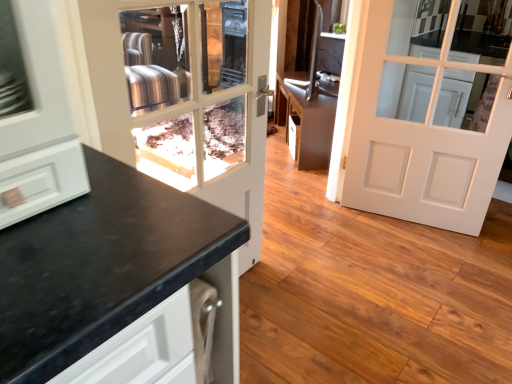
Identify the location of white matte door at center, placed as the second door when sorted from left to right. (429, 112).

Locate an element on the screen. matte black door at center, arranged as the first door when viewed from the left is located at coordinates pyautogui.click(x=183, y=95).

Does white matte door at center, placed as the first door when sorted from right to left, have a greater width compared to matte black door at center, marked as the second door in a right-to-left arrangement?

Indeed, white matte door at center, placed as the first door when sorted from right to left, has a greater width compared to matte black door at center, marked as the second door in a right-to-left arrangement.

Is the position of white matte door at center, placed as the first door when sorted from right to left, less distant than that of matte black door at center, marked as the second door in a right-to-left arrangement?

No, the depth of white matte door at center, placed as the first door when sorted from right to left, is greater than that of matte black door at center, marked as the second door in a right-to-left arrangement.

Is white matte door at center, placed as the first door when sorted from right to left, looking in the opposite direction of matte black door at center, marked as the second door in a right-to-left arrangement?

No, white matte door at center, placed as the first door when sorted from right to left, is not facing away from matte black door at center, marked as the second door in a right-to-left arrangement.

Does point (388, 142) lie behind point (240, 136)?

No, (388, 142) is in front of (240, 136).

Considering the relative positions of matte black door at center, marked as the second door in a right-to-left arrangement, and white matte door at center, placed as the second door when sorted from left to right, in the image provided, is matte black door at center, marked as the second door in a right-to-left arrangement, to the left of white matte door at center, placed as the second door when sorted from left to right, from the viewer's perspective?

Yes, matte black door at center, marked as the second door in a right-to-left arrangement, is to the left of white matte door at center, placed as the second door when sorted from left to right.

Is matte black door at center, arranged as the first door when viewed from the left, touching white matte door at center, placed as the first door when sorted from right to left?

No, matte black door at center, arranged as the first door when viewed from the left, is not beside white matte door at center, placed as the first door when sorted from right to left.

This screenshot has height=384, width=512. Identify the location of door that appears on the right of matte black door at center, arranged as the first door when viewed from the left. (429, 112).

Consider the image. Can you tell me how much matte black door at center, arranged as the first door when viewed from the left, and white matte door at center, placed as the second door when sorted from left to right, differ in facing direction?

The facing directions of matte black door at center, arranged as the first door when viewed from the left, and white matte door at center, placed as the second door when sorted from left to right, are 75.2 degrees apart.

From the picture: Does brown matte cabinet at center turn towards matte black door at center, marked as the second door in a right-to-left arrangement?

No, brown matte cabinet at center is not aimed at matte black door at center, marked as the second door in a right-to-left arrangement.

Is point (313, 164) positioned after point (122, 91)?

That is True.

Is brown matte cabinet at center not inside matte black door at center, arranged as the first door when viewed from the left?

Yes, brown matte cabinet at center is outside of matte black door at center, arranged as the first door when viewed from the left.

Are brown matte cabinet at center and matte black door at center, arranged as the first door when viewed from the left, making contact?

No, brown matte cabinet at center is not making contact with matte black door at center, arranged as the first door when viewed from the left.

Looking at the image, does matte black door at center, marked as the second door in a right-to-left arrangement, seem bigger or smaller compared to brown matte cabinet at center?

Considering their sizes, matte black door at center, marked as the second door in a right-to-left arrangement, takes up less space than brown matte cabinet at center.

Is matte black door at center, arranged as the first door when viewed from the left, to the left of brown matte cabinet at center from the viewer's perspective?

Correct, you'll find matte black door at center, arranged as the first door when viewed from the left, to the left of brown matte cabinet at center.

Is matte black door at center, arranged as the first door when viewed from the left, facing away from brown matte cabinet at center?

That's not correct — matte black door at center, arranged as the first door when viewed from the left, is not looking away from brown matte cabinet at center.

How many degrees apart are the facing directions of matte black door at center, marked as the second door in a right-to-left arrangement, and brown matte cabinet at center?

matte black door at center, marked as the second door in a right-to-left arrangement, and brown matte cabinet at center are facing 125 degrees away from each other.

Considering the relative sizes of white matte door at center, placed as the first door when sorted from right to left, and brown matte cabinet at center in the image provided, is white matte door at center, placed as the first door when sorted from right to left, wider than brown matte cabinet at center?

Incorrect, the width of white matte door at center, placed as the first door when sorted from right to left, does not surpass that of brown matte cabinet at center.

What's the angular difference between white matte door at center, placed as the first door when sorted from right to left, and brown matte cabinet at center's facing directions?

The facing directions of white matte door at center, placed as the first door when sorted from right to left, and brown matte cabinet at center are 50.1 degrees apart.

Between point (371, 39) and point (323, 131), which one is positioned in front?

The point (371, 39) is closer to the camera.

Is white matte door at center, placed as the first door when sorted from right to left, not within brown matte cabinet at center?

Yes.

Is white matte door at center, placed as the first door when sorted from right to left, at the back of brown matte cabinet at center?

brown matte cabinet at center does not have its back to white matte door at center, placed as the first door when sorted from right to left.

From a real-world perspective, between brown matte cabinet at center and white matte door at center, placed as the first door when sorted from right to left, who is vertically higher?

In real-world perspective, white matte door at center, placed as the first door when sorted from right to left, is above.

Is brown matte cabinet at center positioned beyond the bounds of white matte door at center, placed as the second door when sorted from left to right?

Yes, brown matte cabinet at center is outside of white matte door at center, placed as the second door when sorted from left to right.

Is brown matte cabinet at center next to white matte door at center, placed as the first door when sorted from right to left, and touching it?

There is a gap between brown matte cabinet at center and white matte door at center, placed as the first door when sorted from right to left.

Find the location of a particular element. This screenshot has height=384, width=512. door beneath the matte black door at center, marked as the second door in a right-to-left arrangement (from a real-world perspective) is located at coordinates (429, 112).

This screenshot has height=384, width=512. I want to click on door on the right side of matte black door at center, marked as the second door in a right-to-left arrangement, so click(x=429, y=112).

Estimate the real-world distances between objects in this image. Which object is further from matte black door at center, marked as the second door in a right-to-left arrangement, white matte door at center, placed as the first door when sorted from right to left, or brown matte cabinet at center?

white matte door at center, placed as the first door when sorted from right to left.

From the image, which object appears to be farther from white matte door at center, placed as the first door when sorted from right to left, brown matte cabinet at center or matte black door at center, marked as the second door in a right-to-left arrangement?

matte black door at center, marked as the second door in a right-to-left arrangement, is positioned further to the anchor white matte door at center, placed as the first door when sorted from right to left.

Estimate the real-world distances between objects in this image. Which object is further from matte black door at center, arranged as the first door when viewed from the left, brown matte cabinet at center or white matte door at center, placed as the first door when sorted from right to left?

Based on the image, white matte door at center, placed as the first door when sorted from right to left, appears to be further to matte black door at center, arranged as the first door when viewed from the left.

Looking at the image, which one is located closer to white matte door at center, placed as the second door when sorted from left to right, matte black door at center, arranged as the first door when viewed from the left, or brown matte cabinet at center?

brown matte cabinet at center is closer to white matte door at center, placed as the second door when sorted from left to right.

Which object lies nearer to the anchor point brown matte cabinet at center, white matte door at center, placed as the second door when sorted from left to right, or matte black door at center, arranged as the first door when viewed from the left?

Among the two, white matte door at center, placed as the second door when sorted from left to right, is located nearer to brown matte cabinet at center.

Looking at the image, which one is located further to brown matte cabinet at center, matte black door at center, arranged as the first door when viewed from the left, or white matte door at center, placed as the first door when sorted from right to left?

matte black door at center, arranged as the first door when viewed from the left, is further to brown matte cabinet at center.

The image size is (512, 384). I want to click on door between matte black door at center, marked as the second door in a right-to-left arrangement, and brown matte cabinet at center from front to back, so click(429, 112).